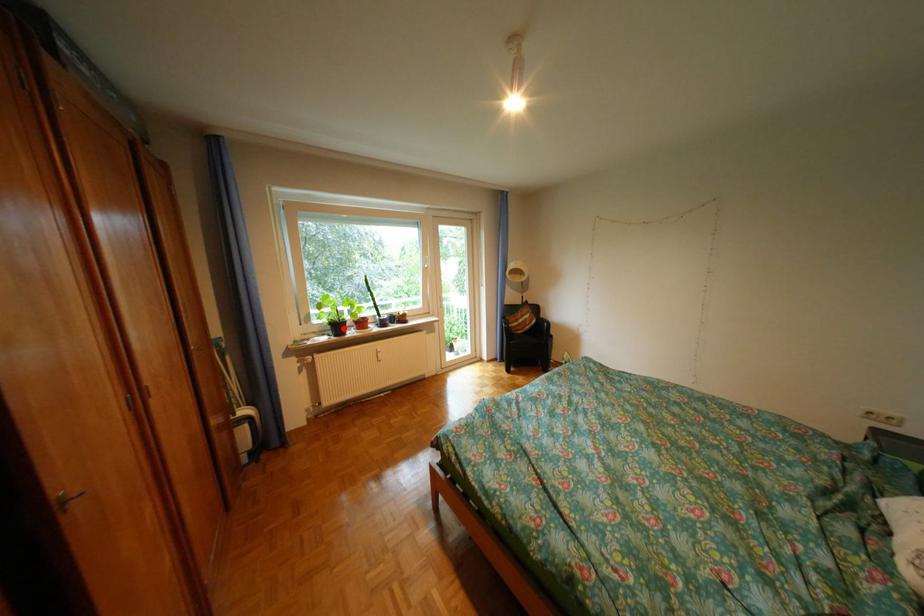
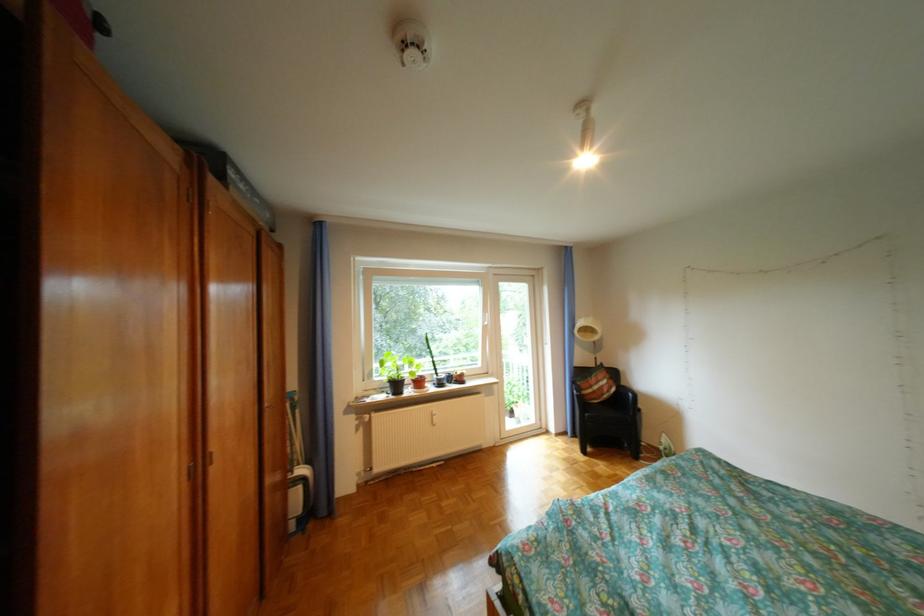
Question: I am providing you with two images of the same scene from different viewpoints. A red point is shown in image1. For the corresponding object point in image2, is it positioned nearer or farther from the camera?

Choices:
 (A) Nearer
 (B) Farther

Answer: (B)